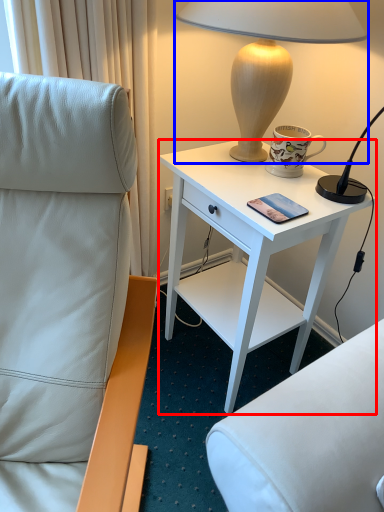
Question: Which object is closer to the camera taking this photo, desk (highlighted by a red box) or lamp (highlighted by a blue box)?

Choices:
 (A) desk
 (B) lamp

Answer: (B)